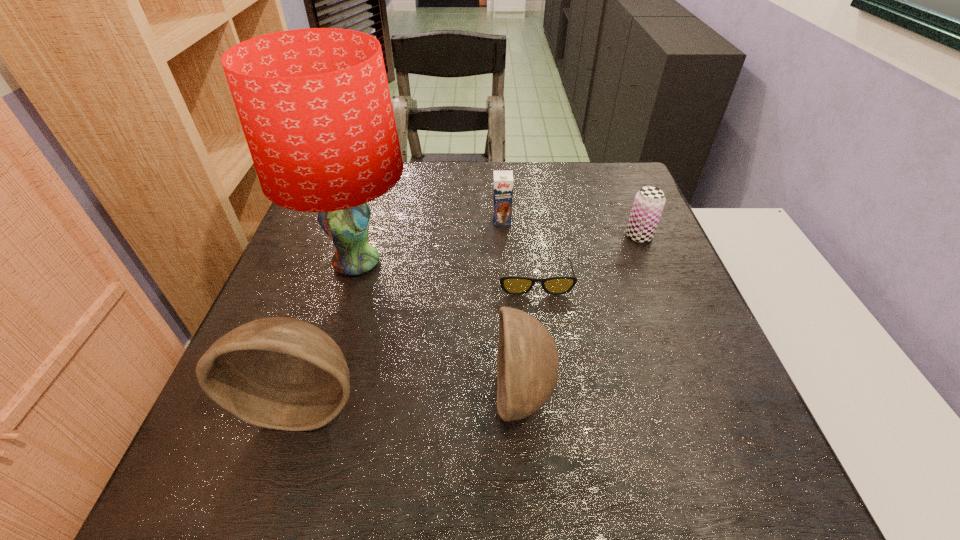
Find the location of a particular element. This screenshot has width=960, height=540. the taller bowl is located at coordinates (281, 373).

I want to click on the fifth shortest object, so click(281, 373).

This screenshot has height=540, width=960. What are the coordinates of `the third tallest object` in the screenshot? It's located at (527, 361).

Locate an element on the screen. The height and width of the screenshot is (540, 960). the right bowl is located at coordinates (527, 361).

You are a GUI agent. You are given a task and a screenshot of the screen. Output one action in this format:
    pyautogui.click(x=<x>, y=<y>)
    Task: Click on the rightmost object
    This screenshot has height=540, width=960.
    Given the screenshot: What is the action you would take?
    pyautogui.click(x=649, y=202)

Where is `the tallest object`? The height and width of the screenshot is (540, 960). the tallest object is located at coordinates (314, 104).

Identify the location of the shortest object. The height and width of the screenshot is (540, 960). (515, 285).

The height and width of the screenshot is (540, 960). I want to click on chocolate milk, so click(502, 180).

Locate an element on the screen. vacant space located on the back of the fifth shortest object is located at coordinates (331, 317).

At what (x,y) coordinates should I click in order to perform the action: click on free spot located 0.260m on the right of the shorter bowl. Please return your answer as a coordinate pair (x, y). The height and width of the screenshot is (540, 960). Looking at the image, I should click on (697, 395).